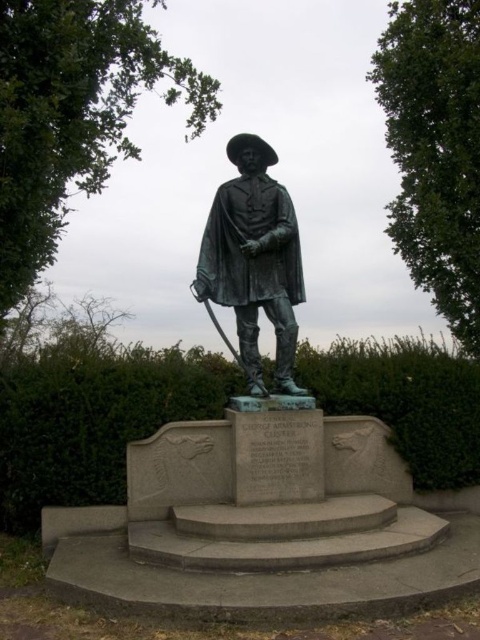
Question: Does green hedge at center have a greater width compared to bronze statue at center?

Choices:
 (A) no
 (B) yes

Answer: (B)

Question: Is green hedge at center below bronze statue at center?

Choices:
 (A) no
 (B) yes

Answer: (B)

Question: Can you confirm if green hedge at center is positioned to the right of bronze statue at center?

Choices:
 (A) yes
 (B) no

Answer: (B)

Question: Which of the following is the closest to the observer?

Choices:
 (A) bronze statue at center
 (B) green hedge at center

Answer: (B)